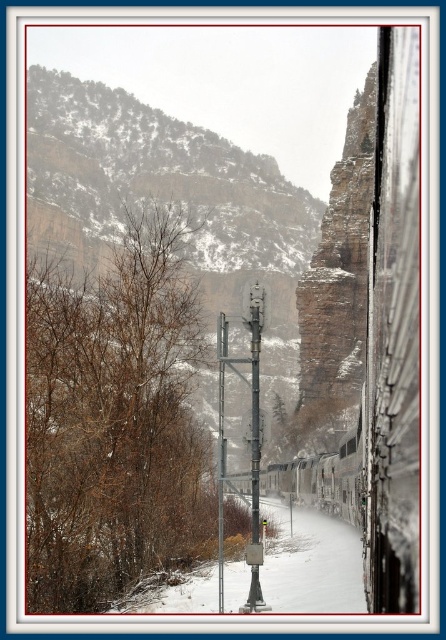
Looking at this image, you are a railway engineer assessing the layout of the tracks. Given the coordinates of the metal train at right, can you determine its position relative to the tunnel entrance?

The metal train at right is located at point coordinates, which places it near the tunnel entrance on the curved track to the right.

From the picture: You are standing at the point closer to the camera between the two points, point (359, 83) and point (260, 593). Which point are you standing at?

You are standing at point (359, 83) because it is further to the camera than point (260, 593).